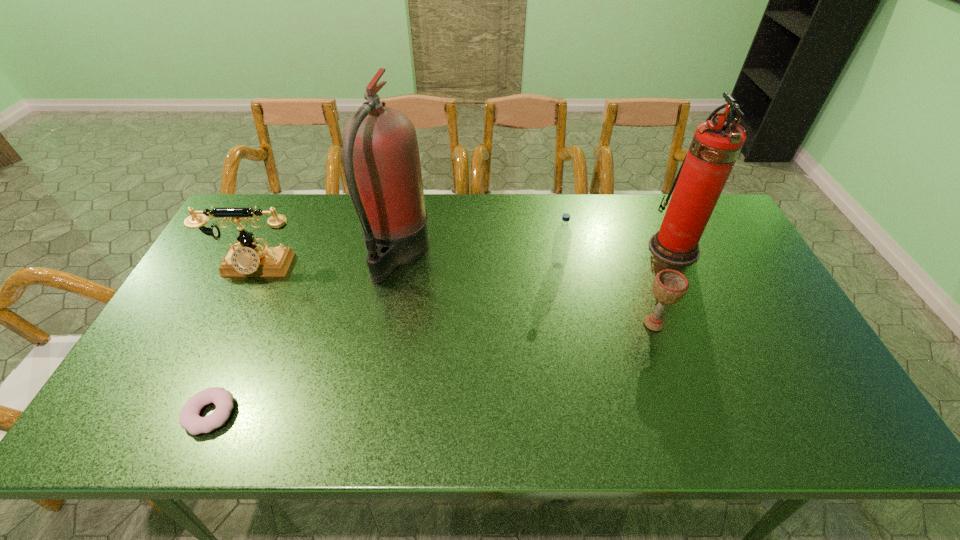
The width and height of the screenshot is (960, 540). Find the location of `object situated at the near left corner`. object situated at the near left corner is located at coordinates (189, 419).

Locate an element on the screen. object positioned at the far right corner is located at coordinates (716, 144).

The image size is (960, 540). I want to click on vacant space at the far edge, so click(x=333, y=227).

Where is `vacant space at the near edge of the desktop`? vacant space at the near edge of the desktop is located at coordinates (428, 411).

Locate an element on the screen. vacant space at the left edge of the desktop is located at coordinates (171, 376).

Where is `vacant space that's between the shortest object and the right fire extinguisher`? vacant space that's between the shortest object and the right fire extinguisher is located at coordinates (442, 330).

You are a GUI agent. You are given a task and a screenshot of the screen. Output one action in this format:
    pyautogui.click(x=<x>, y=<y>)
    Task: Click on the vacant space in between the rightmost object and the fourth object from right to left
    
    Given the screenshot: What is the action you would take?
    pyautogui.click(x=535, y=251)

The width and height of the screenshot is (960, 540). I want to click on vacant area that lies between the right fire extinguisher and the telephone, so click(465, 258).

Where is `free space between the doughnut and the rightmost object`? The image size is (960, 540). free space between the doughnut and the rightmost object is located at coordinates (442, 330).

In order to click on empty location between the fourth object from right to left and the rightmost object in this screenshot , I will do `click(535, 251)`.